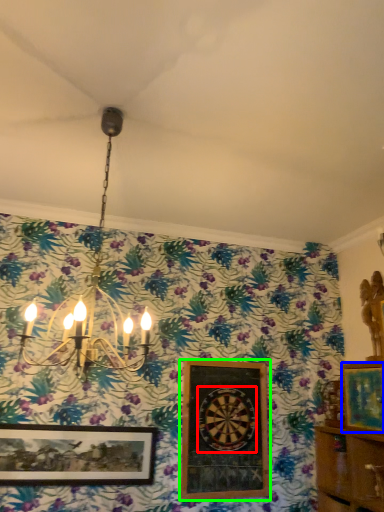
Question: Estimate the real-world distances between objects in this image. Which object is closer to design (highlighted by a red box), picture frame (highlighted by a blue box) or picture frame (highlighted by a green box)?

Choices:
 (A) picture frame
 (B) picture frame

Answer: (B)